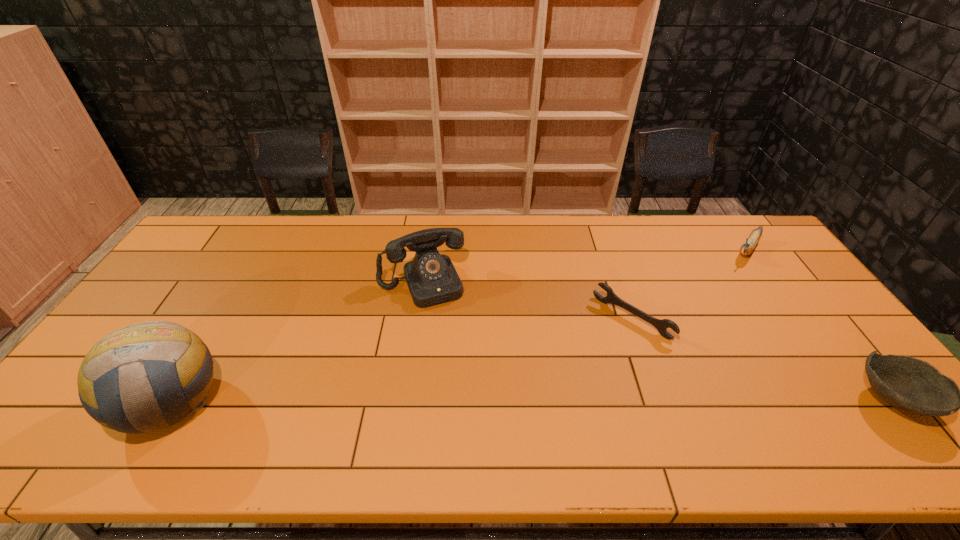
In the image, there is a desktop. Where is `vacant space at the left edge`? The width and height of the screenshot is (960, 540). vacant space at the left edge is located at coordinates (176, 301).

This screenshot has width=960, height=540. In the image, there is a desktop. In order to click on vacant space at the right edge in this screenshot , I will do `click(787, 288)`.

What are the coordinates of `vacant area at the far right corner` in the screenshot? It's located at (745, 229).

This screenshot has height=540, width=960. In order to click on free space between the second object from left to right and the fourth tallest object in this screenshot , I will do `click(658, 341)`.

The width and height of the screenshot is (960, 540). What are the coordinates of `vacant space that's between the bowl and the wrench` in the screenshot? It's located at (762, 359).

This screenshot has width=960, height=540. What are the coordinates of `blank region between the banana and the tallest object` in the screenshot? It's located at (459, 326).

At what (x,y) coordinates should I click in order to perform the action: click on vacant area that lies between the second object from left to right and the bowl. Please return your answer as a coordinate pair (x, y). This screenshot has width=960, height=540. Looking at the image, I should click on (x=658, y=341).

Find the location of a particular element. The width and height of the screenshot is (960, 540). empty location between the banana and the wrench is located at coordinates (689, 284).

In order to click on free space between the third object from left to right and the bowl in this screenshot , I will do `click(762, 359)`.

Where is `free point between the tallest object and the bowl`? The width and height of the screenshot is (960, 540). free point between the tallest object and the bowl is located at coordinates (532, 401).